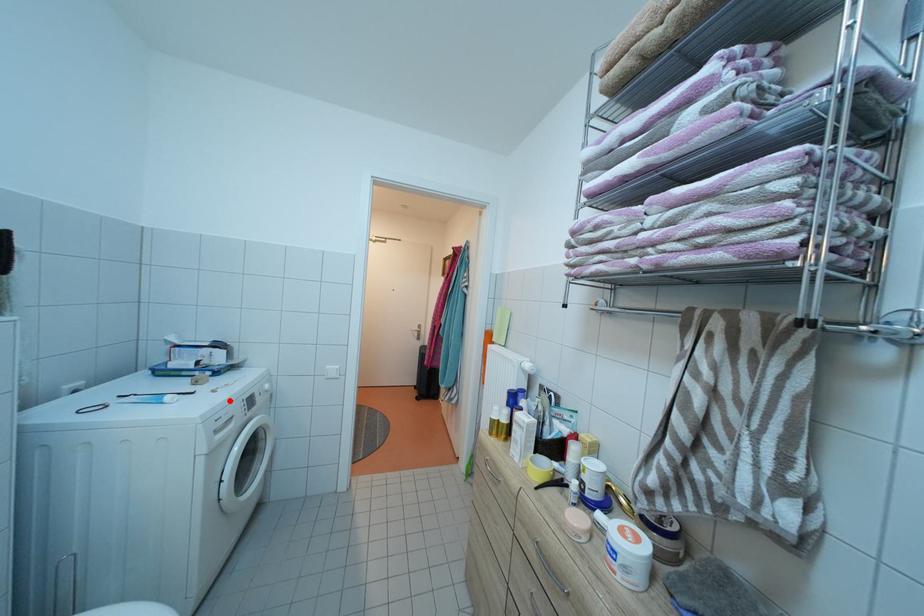
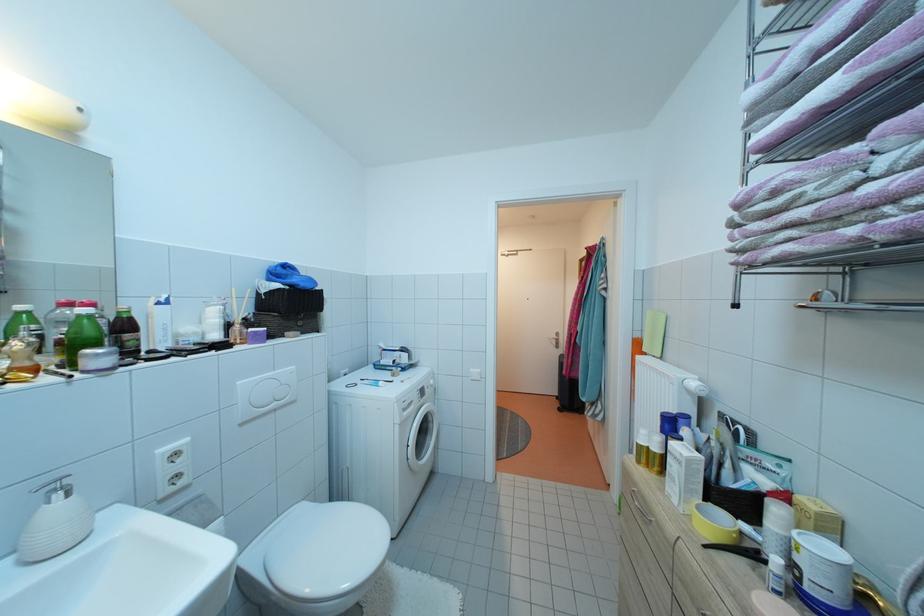
The point at the highlighted location is marked in the first image. Where is the corresponding point in the second image?

(415, 391)